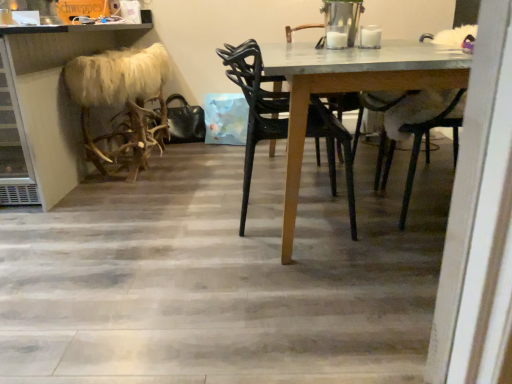
Question: Are furry white antlers at left and white fur at upper right located far from each other?

Choices:
 (A) no
 (B) yes

Answer: (B)

Question: From the image's perspective, is furry white antlers at left located above white fur at upper right?

Choices:
 (A) yes
 (B) no

Answer: (A)

Question: Is furry white antlers at left wider than white fur at upper right?

Choices:
 (A) no
 (B) yes

Answer: (B)

Question: Can you confirm if furry white antlers at left is positioned to the right of white fur at upper right?

Choices:
 (A) no
 (B) yes

Answer: (A)

Question: Can you confirm if furry white antlers at left is thinner than white fur at upper right?

Choices:
 (A) yes
 (B) no

Answer: (B)

Question: Is furry white antlers at left oriented away from white fur at upper right?

Choices:
 (A) yes
 (B) no

Answer: (B)

Question: From a real-world perspective, is faux fur stool at left located beneath white fur at upper right?

Choices:
 (A) yes
 (B) no

Answer: (B)

Question: Can you confirm if faux fur stool at left is bigger than white fur at upper right?

Choices:
 (A) no
 (B) yes

Answer: (B)

Question: Would you say faux fur stool at left contains white fur at upper right?

Choices:
 (A) no
 (B) yes

Answer: (A)

Question: Can you confirm if faux fur stool at left is positioned to the left of white fur at upper right?

Choices:
 (A) yes
 (B) no

Answer: (A)

Question: Is faux fur stool at left beside white fur at upper right?

Choices:
 (A) yes
 (B) no

Answer: (B)

Question: Can you confirm if faux fur stool at left is wider than white fur at upper right?

Choices:
 (A) yes
 (B) no

Answer: (A)

Question: Is black plastic chair at center positioned with its back to white fur at upper right?

Choices:
 (A) yes
 (B) no

Answer: (B)